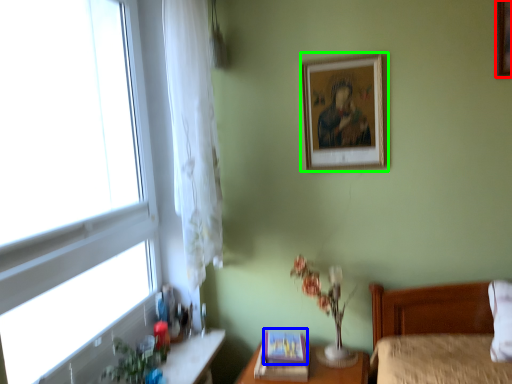
Question: Which is nearer to the picture frame (highlighted by a red box)? picture frame (highlighted by a blue box) or picture frame (highlighted by a green box).

Choices:
 (A) picture frame
 (B) picture frame

Answer: (B)